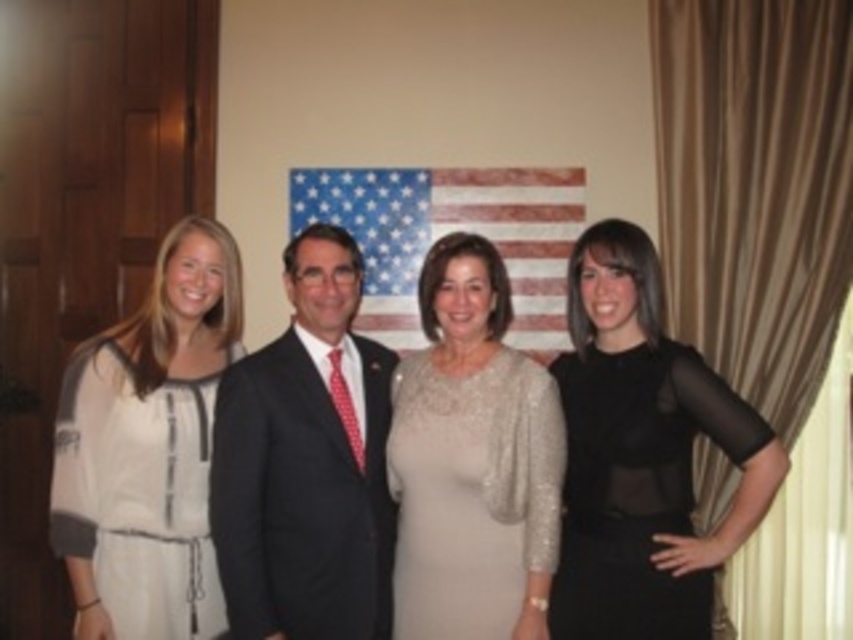
You are a photographer adjusting the camera settings to ensure all subjects are in focus. The dark suit at center and the sequined beige dress at center are both in the frame. Which one is taller?

The dark suit at center is taller than the sequined beige dress at center.

You are a photographer adjusting the camera settings for the group photo. You need to ensure that both the black sheer dress at right and the dark suit at center are fully in frame. Which clothing item requires a wider angle lens to capture its full width?

The black sheer dress at right requires a wider angle lens because its width surpasses that of the dark suit at center.

You are a photographer adjusting the lighting for a group photo. You notice the dark suit at center and the sequined beige dress at center. Which clothing item is closer to the camera?

The dark suit at center is in front of the sequined beige dress at center, so it is closer to the camera.